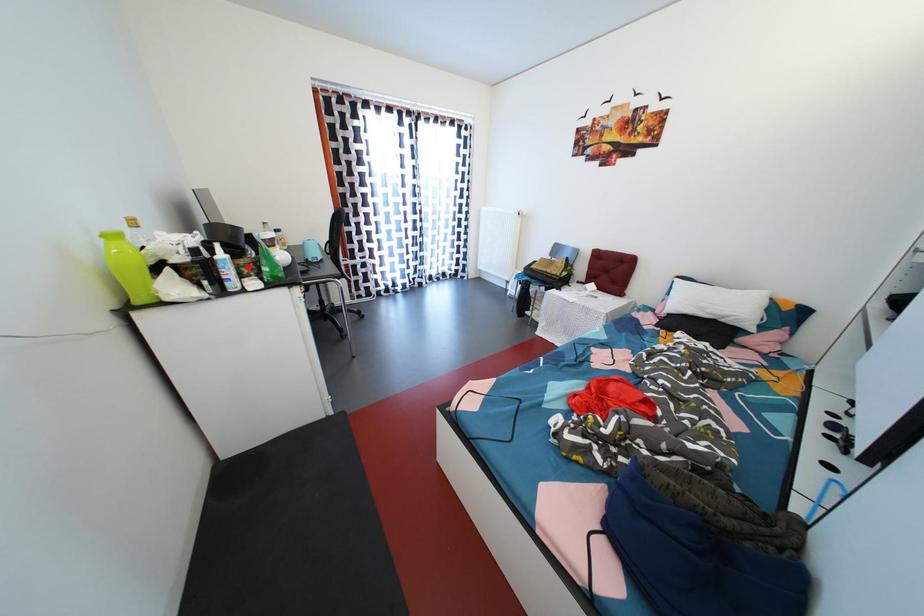
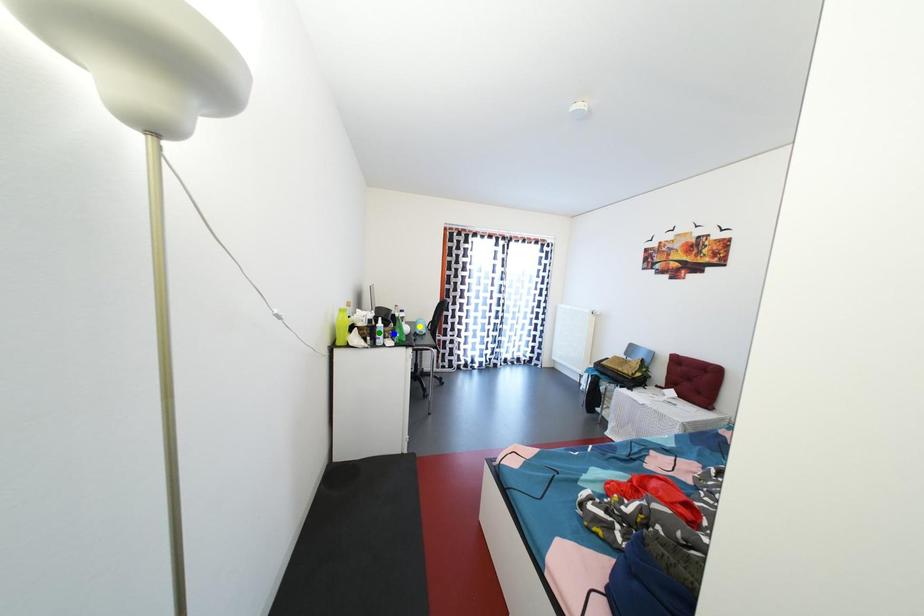
Question: I am providing you with two images of the same scene from different viewpoints. A red point is marked on the first image. You are given multiple points on the second image. Can you choose the point in image 2 that corresponds to the point in image 1?

Choices:
 (A) blue point
 (B) yellow point
 (C) green point

Answer: (A)